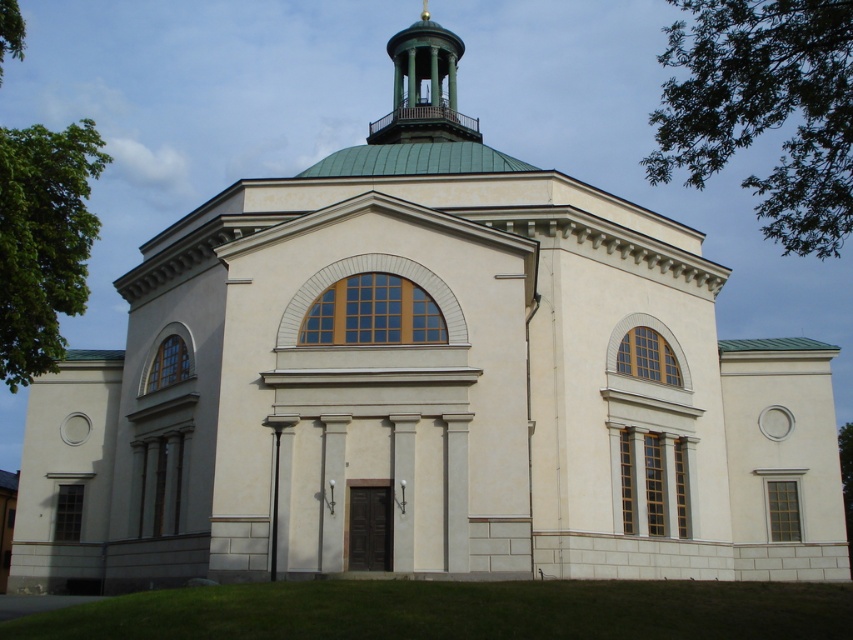
Question: Is green leafy tree at left smaller than green matte dome at upper center?

Choices:
 (A) no
 (B) yes

Answer: (A)

Question: Which point is closer to the camera taking this photo?

Choices:
 (A) (32, 289)
 (B) (393, 38)
 (C) (811, 102)

Answer: (C)

Question: Is green leafy tree at upper right in front of green leafy tree at left?

Choices:
 (A) no
 (B) yes

Answer: (B)

Question: Considering the real-world distances, which object is closest to the green matte dome at upper center?

Choices:
 (A) green leafy tree at upper right
 (B) green leafy tree at left

Answer: (B)

Question: Which of the following is the farthest from the observer?

Choices:
 (A) (30, 179)
 (B) (712, 125)

Answer: (B)

Question: Is green leafy tree at left above green matte dome at upper center?

Choices:
 (A) no
 (B) yes

Answer: (A)